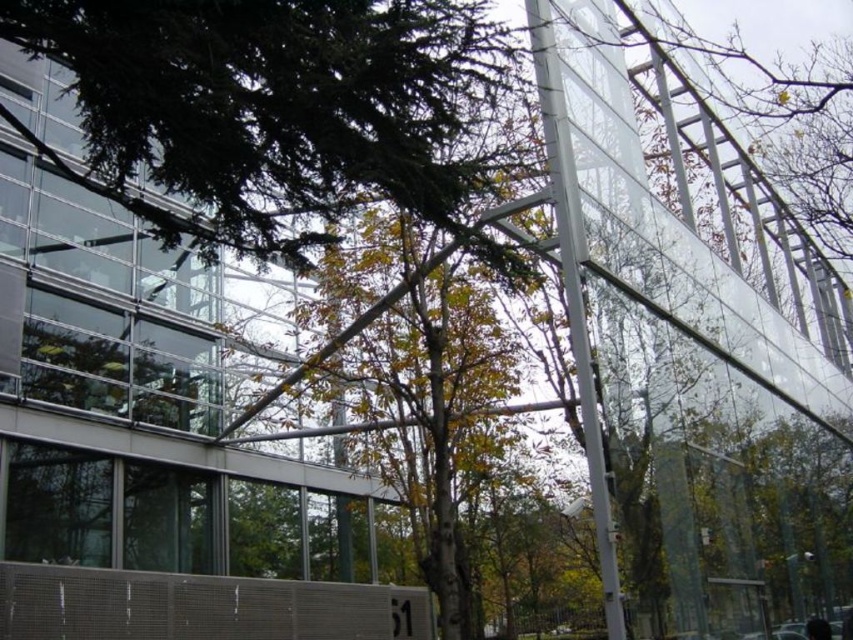
Consider the image. You are standing in front of the modern building and notice two trees in the scene. Which tree, the green leafy tree at upper center or the green leafy tree at center, is closer to the building?

The green leafy tree at upper center is positioned over the green leafy tree at center, meaning it is closer to the building.

Looking at this image, you are standing in front of the building and want to take a photo of the green leafy tree at upper center. What are the coordinates of the tree to ensure it is centered in your photo?

The coordinates of the green leafy tree at upper center are at point [283,109], so you should center your photo at those coordinates to capture it properly.

You are an urban planner assessing the building. You notice two trees, the green leafy tree at upper center and the green leafy tree at center. Which tree has a smaller width?

The green leafy tree at upper center is thinner than the green leafy tree at center, so the green leafy tree at upper center has a smaller width.